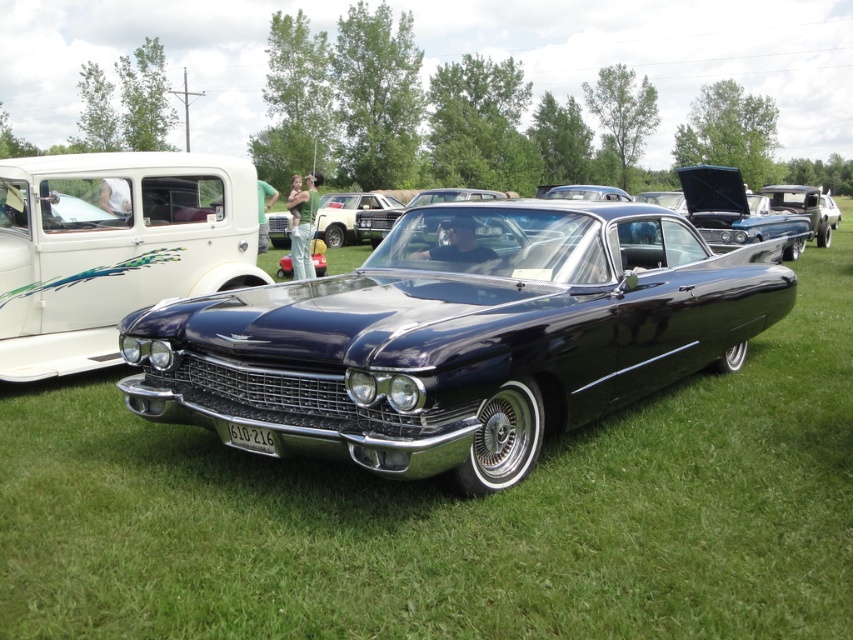
Question: Is shiny dark blue car at center positioned at the back of white glossy pickup truck at upper left?

Choices:
 (A) no
 (B) yes

Answer: (A)

Question: Is shiny dark blue car at center bigger than white glossy pickup truck at upper left?

Choices:
 (A) yes
 (B) no

Answer: (A)

Question: Which object is farther from the camera taking this photo?

Choices:
 (A) white glossy pickup truck at upper left
 (B) shiny dark blue car at center

Answer: (A)

Question: Is shiny dark blue car at center to the left of white glossy pickup truck at upper left from the viewer's perspective?

Choices:
 (A) no
 (B) yes

Answer: (A)